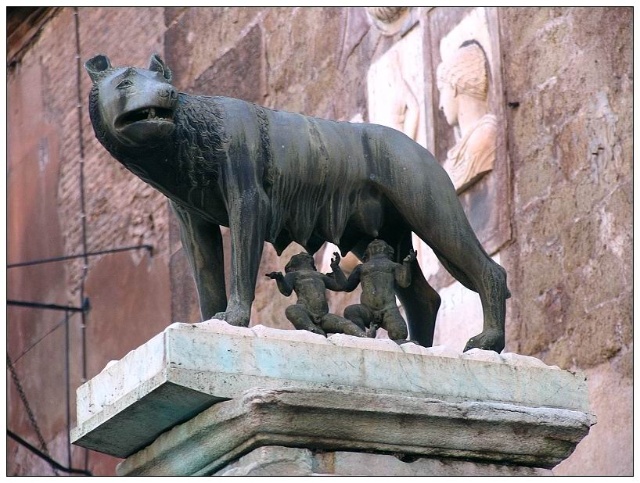
This screenshot has width=640, height=483. I want to click on white marble base, so click(121, 380).